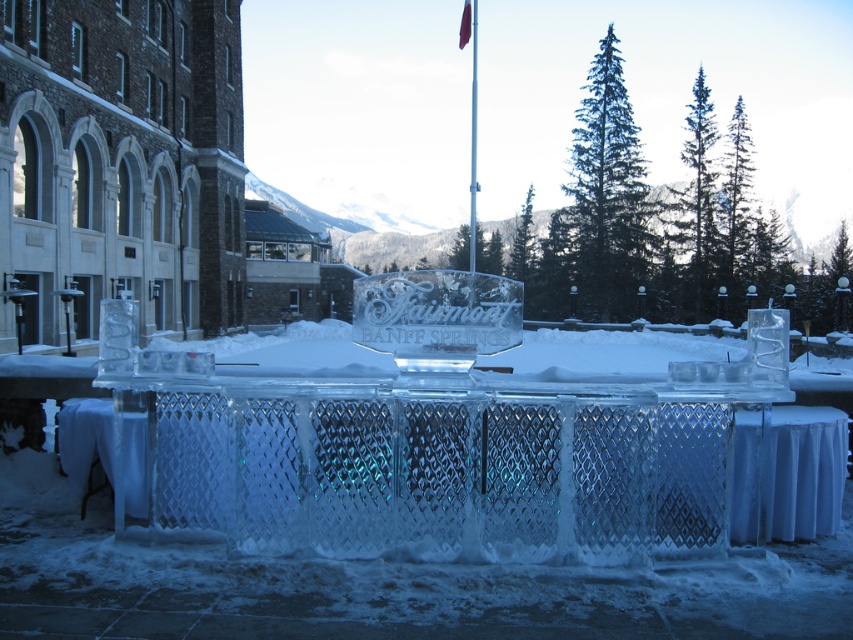
You are standing in front of the ice sculpture display. You want to take a photo of the metallic flag pole at center without the clear ice table at center blocking the view. Is it possible to do so from your current position?

The clear ice table at center is further to the viewer than the metallic flag pole at center, so the flag pole is behind the table. Therefore, you cannot take a photo of the metallic flag pole at center without the clear ice table at center blocking the view from your current position.

You are standing in the winter scene and want to place a 1.5 meter long scarf on the clear ice table at center. Can you reach the table from your current position without moving closer?

The clear ice table at center is 5.50 meters away from the viewer. Since the scarf is only 1.5 meters long, you cannot reach the table without moving closer.